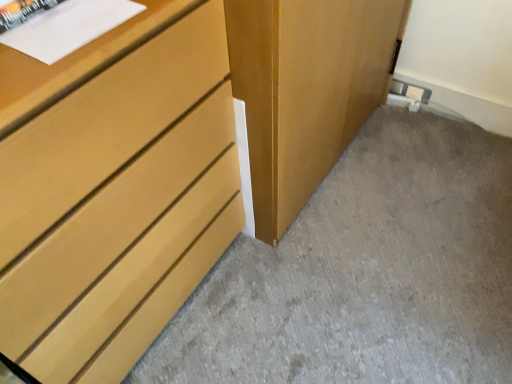
This screenshot has height=384, width=512. I want to click on vacant space situated above matte wood dresser at lower left (from a real-world perspective), so click(x=377, y=240).